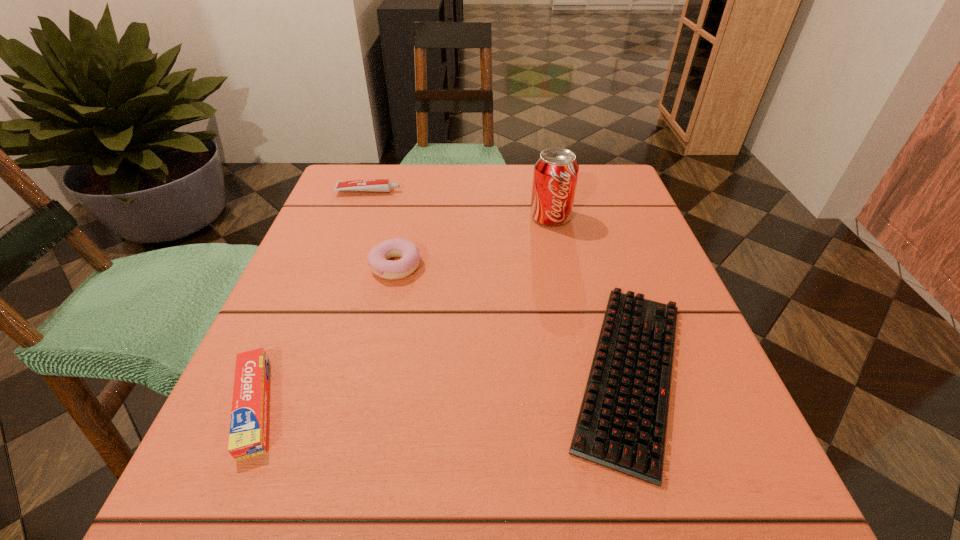
This screenshot has width=960, height=540. I want to click on object that is at the near left corner, so click(248, 427).

At what (x,y) coordinates should I click in order to perform the action: click on object situated at the far right corner. Please return your answer as a coordinate pair (x, y). Image resolution: width=960 pixels, height=540 pixels. Looking at the image, I should click on (556, 170).

What are the coordinates of `object that is positioned at the near right corner` in the screenshot? It's located at (622, 422).

In the image, there is a desktop. Where is `vacant space at the near edge`? Image resolution: width=960 pixels, height=540 pixels. vacant space at the near edge is located at coordinates (383, 515).

I want to click on vacant area at the left edge of the desktop, so click(x=320, y=244).

What are the coordinates of `blank space at the right edge of the desktop` in the screenshot? It's located at (660, 299).

Where is `free space at the near left corner of the desktop`? The image size is (960, 540). free space at the near left corner of the desktop is located at coordinates pos(266,479).

The width and height of the screenshot is (960, 540). What are the coordinates of `vacant space at the far right corner of the desktop` in the screenshot? It's located at (592, 198).

Identify the location of empty space that is in between the farthest object and the nearer toothpaste. This screenshot has width=960, height=540. (311, 298).

I want to click on free space between the tallest object and the doughnut, so click(x=473, y=241).